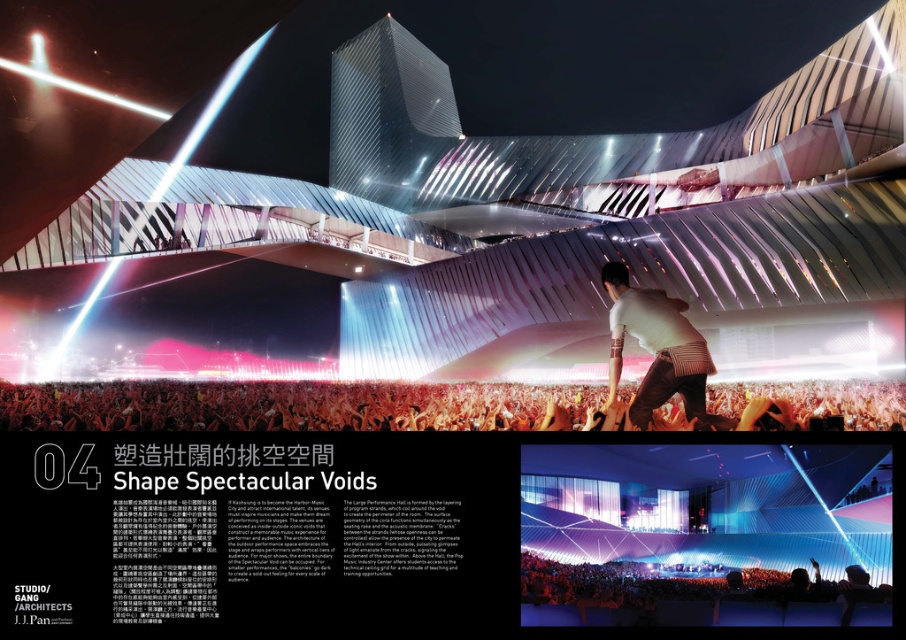
You are an event planner trying to decide where to place a new banner. You see the translucent blue fabric at center and the white matte shirt at upper center in the image. Which object is positioned higher up in the scene?

The translucent blue fabric at center is taller than the white matte shirt at upper center, so the translucent blue fabric at center is positioned higher up in the scene.

You are designing a display for a clothing store and need to arrange the white cotton shirt at center and the white matte shirt at upper center. Based on their sizes, which shirt should be placed on the shelf first to ensure proper fitting?

The white cotton shirt at center might be wider than the white matte shirt at upper center, so it should be placed first to accommodate its width.

You are a stage designer preparing for a performance. You have two materials available for a costume piece at the center of the stage. The translucent blue fabric at center and the white cotton shirt at center. Which material would allow more light to pass through?

The translucent blue fabric at center is thinner than the white cotton shirt at center, so it allows more light to pass through.